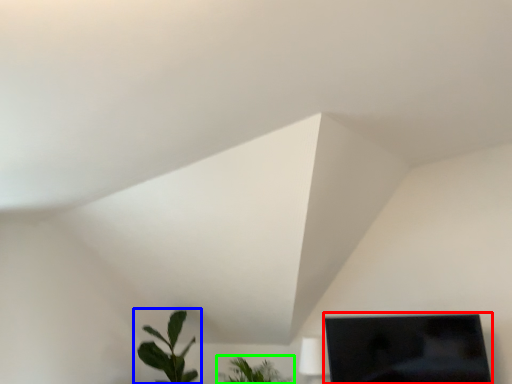
Question: Which is farther away from computer monitor (highlighted by a red box)? houseplant (highlighted by a blue box) or houseplant (highlighted by a green box)?

Choices:
 (A) houseplant
 (B) houseplant

Answer: (A)